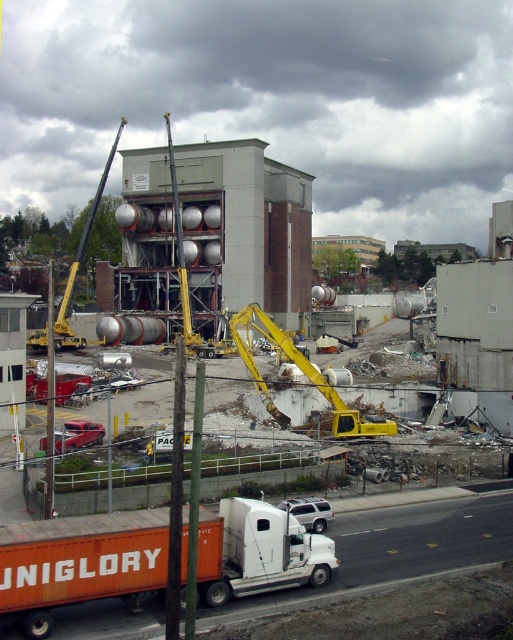
You are a construction worker who needs to move a heavy load from the orange matte trailer truck at lower left to the yellow metallic excavator at center. Which vehicle should you start loading the load onto first, and why?

You should start loading the load onto the orange matte trailer truck at lower left first because it is closer to the viewer than the yellow metallic excavator at center, making it more accessible for immediate loading.

You are a construction worker needing to move heavy debris from the demolition site. You have access to an orange matte trailer truck at lower left and a yellow metallic excavator at center. Which vehicle should you choose if you need the one that takes up more space to handle larger loads efficiently?

The yellow metallic excavator at center should be chosen because it occupies more space than the orange matte trailer truck at lower left, making it better suited for handling larger loads efficiently.